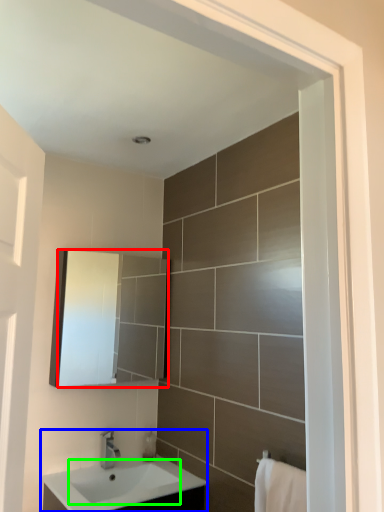
Question: Which object is positioned farthest from mirror (highlighted by a red box)? Select from sink (highlighted by a blue box) and sink (highlighted by a green box).

Choices:
 (A) sink
 (B) sink

Answer: (B)